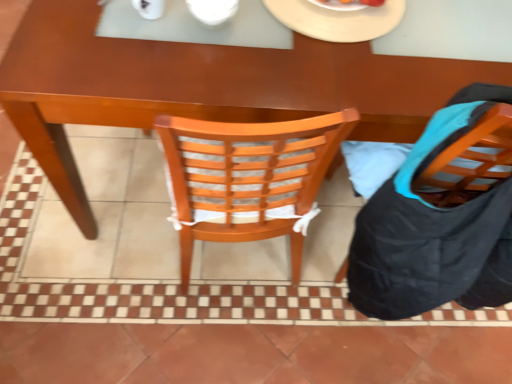
At what (x,y) coordinates should I click in order to perform the action: click on unoccupied region to the right of white matte plate at upper center. Please return your answer as a coordinate pair (x, y). The height and width of the screenshot is (384, 512). Looking at the image, I should click on (458, 30).